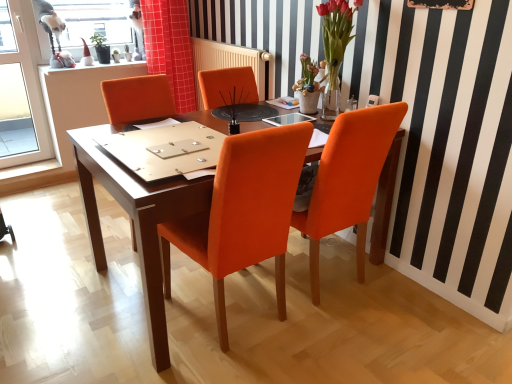
Locate an element on the screen. This screenshot has width=512, height=384. vacant space situated on the left part of orange leather chair at center, which is the 1th chair from left to right is located at coordinates (98, 335).